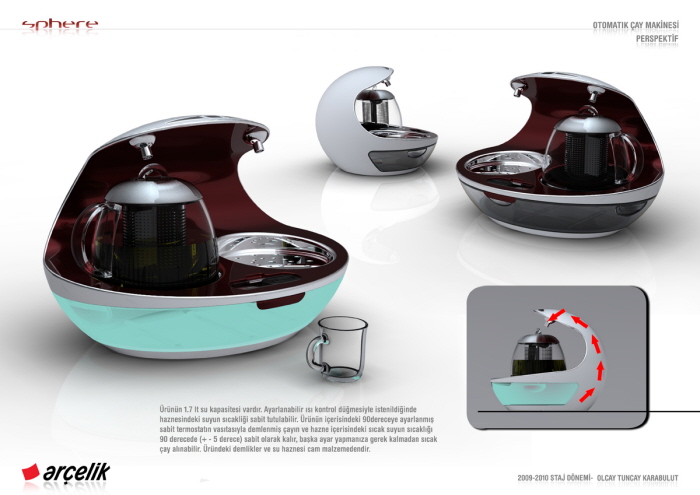
In order to click on handle in this screenshot , I will do `click(315, 368)`, `click(314, 344)`.